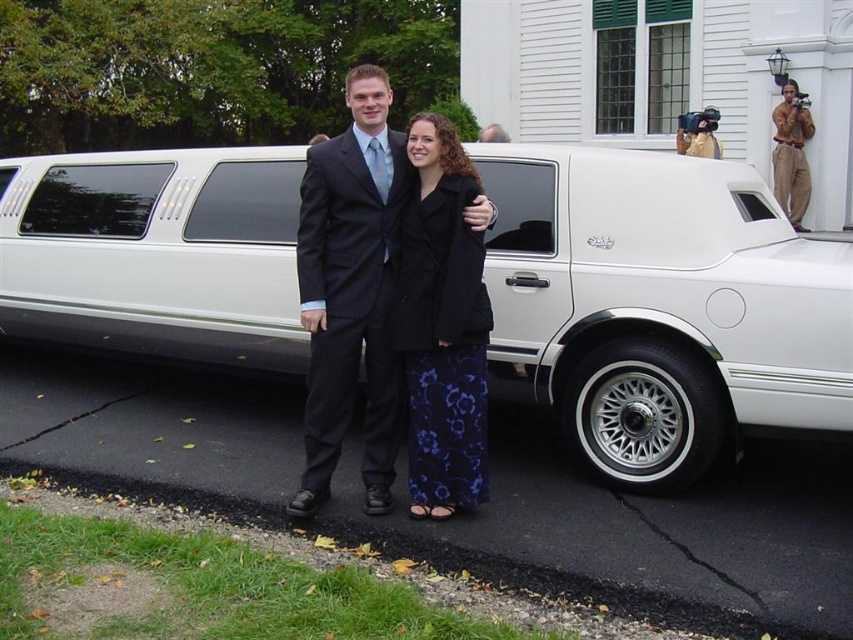
Question: Is white metallic limousine at center to the left of tan cotton pants at upper right from the viewer's perspective?

Choices:
 (A) yes
 (B) no

Answer: (A)

Question: Which object appears farthest from the camera in this image?

Choices:
 (A) tan cotton pants at upper right
 (B) black matte coat at center
 (C) dark blue fabric business suit at center

Answer: (A)

Question: Can you confirm if matte black suit at center is thinner than black matte coat at center?

Choices:
 (A) yes
 (B) no

Answer: (B)

Question: Which point appears farthest from the camera in this image?

Choices:
 (A) (426, 148)
 (B) (349, 346)
 (C) (775, 192)
 (D) (697, 372)

Answer: (C)

Question: Does white metallic limousine at center appear over black matte coat at center?

Choices:
 (A) no
 (B) yes

Answer: (B)

Question: Which object is positioned farthest from the matte black suit at center?

Choices:
 (A) black matte coat at center
 (B) white metallic limousine at center

Answer: (B)